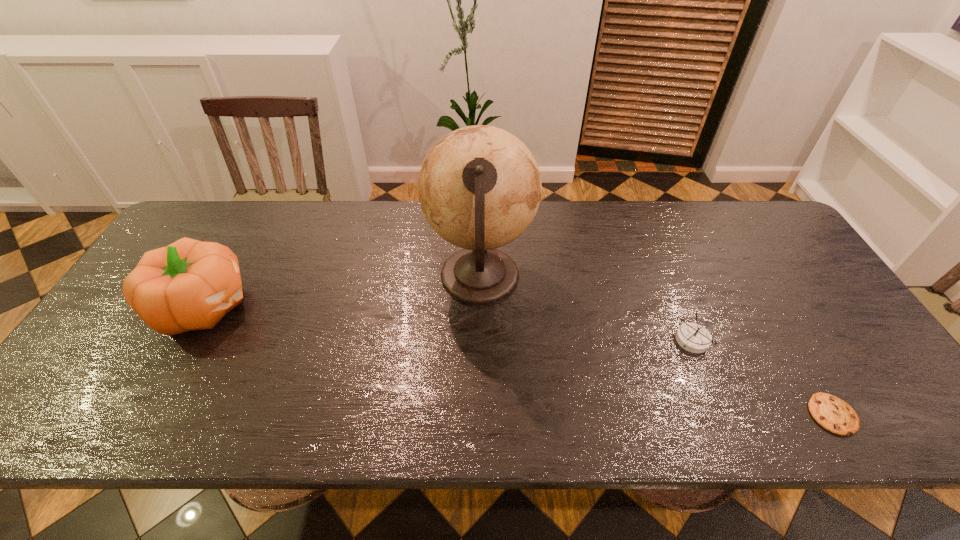
Where is `vacant space located 0.230m on the right of the second shortest object`? vacant space located 0.230m on the right of the second shortest object is located at coordinates (802, 341).

Where is `vacant space located on the back of the cookie`? vacant space located on the back of the cookie is located at coordinates (748, 271).

The image size is (960, 540). I want to click on object at the far edge, so click(479, 187).

You are a GUI agent. You are given a task and a screenshot of the screen. Output one action in this format:
    pyautogui.click(x=<x>, y=<y>)
    Task: Click on the object that is at the near edge
    Image resolution: width=960 pixels, height=540 pixels.
    Given the screenshot: What is the action you would take?
    pyautogui.click(x=833, y=414)

You are a GUI agent. You are given a task and a screenshot of the screen. Output one action in this format:
    pyautogui.click(x=<x>, y=<y>)
    Task: Click on the object situated at the left edge
    The width and height of the screenshot is (960, 540).
    Given the screenshot: What is the action you would take?
    pyautogui.click(x=188, y=285)

The width and height of the screenshot is (960, 540). Find the location of `object that is at the right edge`. object that is at the right edge is located at coordinates (833, 414).

The width and height of the screenshot is (960, 540). What are the coordinates of `object present at the near right corner` in the screenshot? It's located at (833, 414).

Identify the location of free region at the far edge of the desktop. Image resolution: width=960 pixels, height=540 pixels. (701, 209).

Image resolution: width=960 pixels, height=540 pixels. What are the coordinates of `free space at the near edge of the desktop` in the screenshot? It's located at (363, 436).

In the image, there is a desktop. Where is `vacant area at the left edge`? vacant area at the left edge is located at coordinates (85, 390).